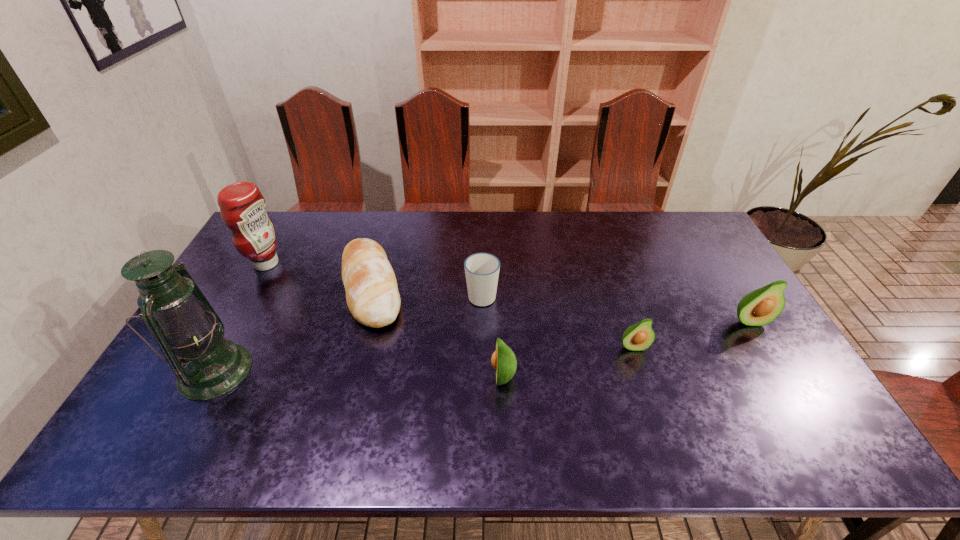
All avocados are currently evenly spaced. To continue this pattern, where would you add another avocado on the left? Please point out a vacant spot. Please provide its 2D coordinates. Your answer should be formatted as a tuple, i.e. [(x, y)], where the tuple contains the x and y coordinates of a point satisfying the conditions above.

[(356, 408)]